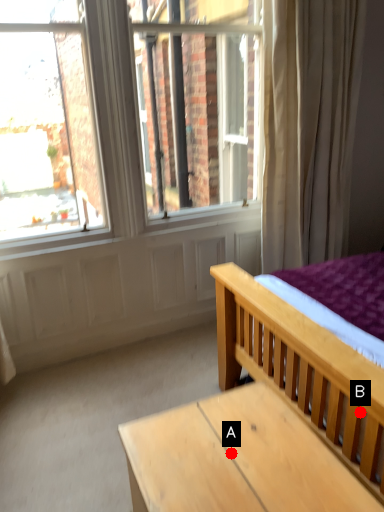
Question: Two points are circled on the image, labeled by A and B beside each circle. Which of the following is the farthest from the observer?

Choices:
 (A) A is further
 (B) B is further

Answer: (B)